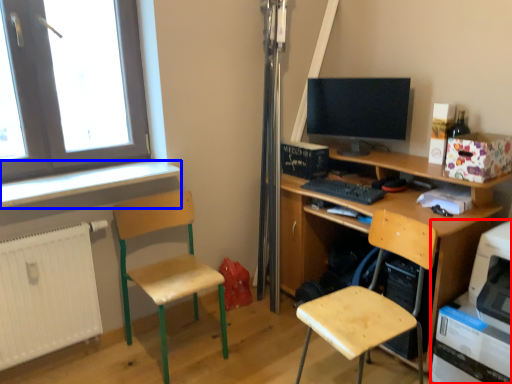
Question: Among these objects, which one is nearest to the camera, printer (highlighted by a red box) or window sill (highlighted by a blue box)?

Choices:
 (A) printer
 (B) window sill

Answer: (A)